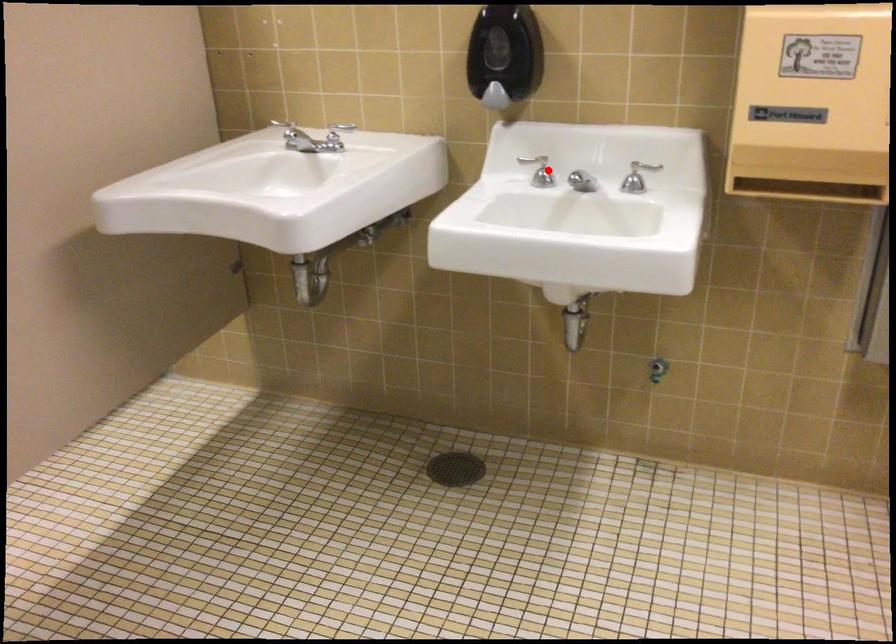
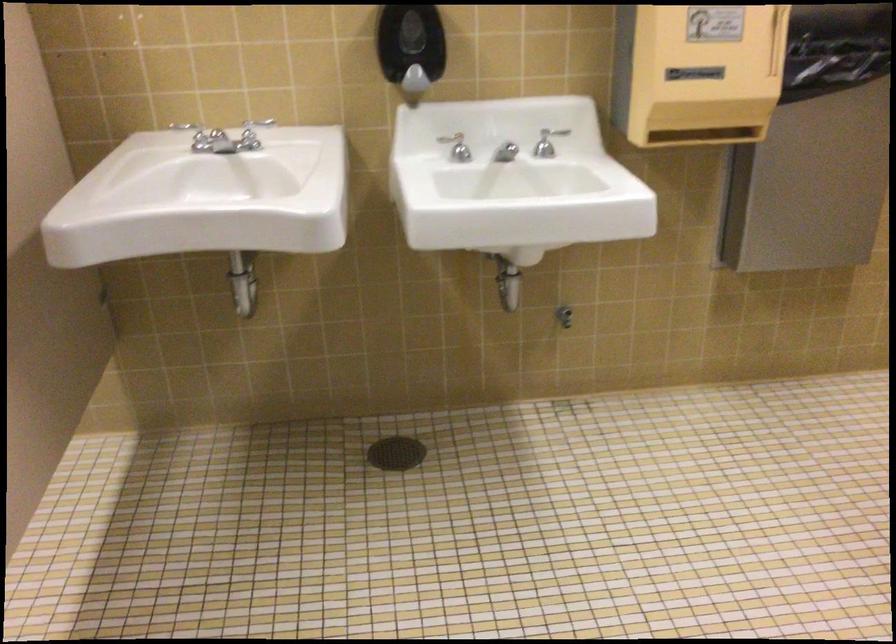
The point at the highlighted location is marked in the first image. Where is the corresponding point in the second image?

(457, 147)